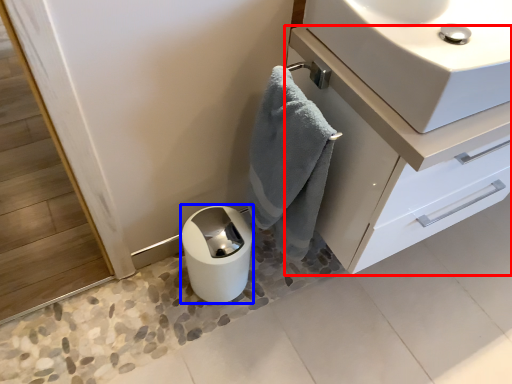
Question: Which of the following is the farthest to the observer, bathroom cabinet (highlighted by a red box) or paper towel (highlighted by a blue box)?

Choices:
 (A) bathroom cabinet
 (B) paper towel

Answer: (B)